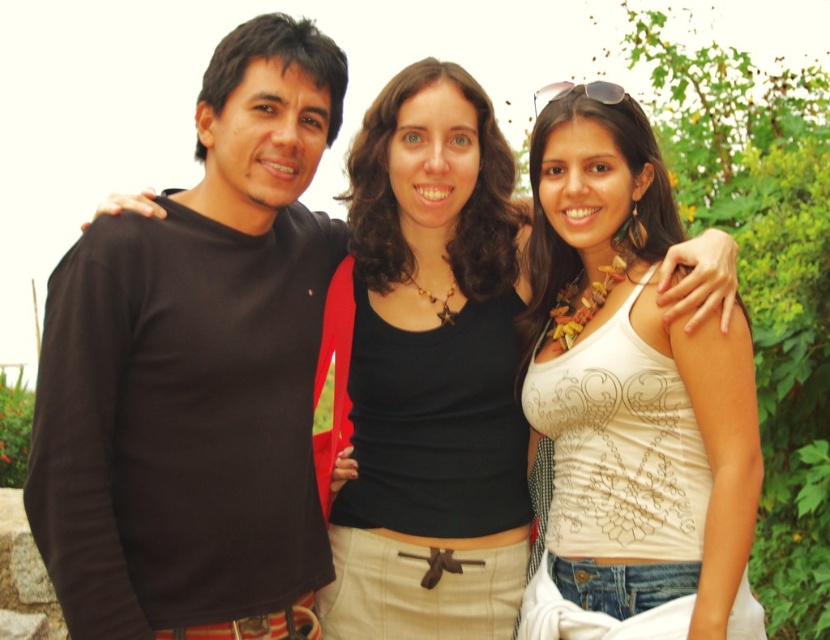
Question: Is white printed tank top at center smaller than black matte tank top at center?

Choices:
 (A) yes
 (B) no

Answer: (B)

Question: Can you confirm if black matte shirt at left is bigger than white printed tank top at center?

Choices:
 (A) no
 (B) yes

Answer: (B)

Question: Which of the following is the closest to the observer?

Choices:
 (A) white printed tank top at center
 (B) black matte shirt at left

Answer: (A)

Question: Which point is closer to the camera taking this photo?

Choices:
 (A) (613, 470)
 (B) (83, 634)
 (C) (457, 461)

Answer: (B)

Question: Which is nearer to the white printed tank top at center?

Choices:
 (A) black matte shirt at left
 (B) black matte tank top at center

Answer: (B)

Question: Is white printed tank top at center to the right of black matte tank top at center from the viewer's perspective?

Choices:
 (A) no
 (B) yes

Answer: (B)